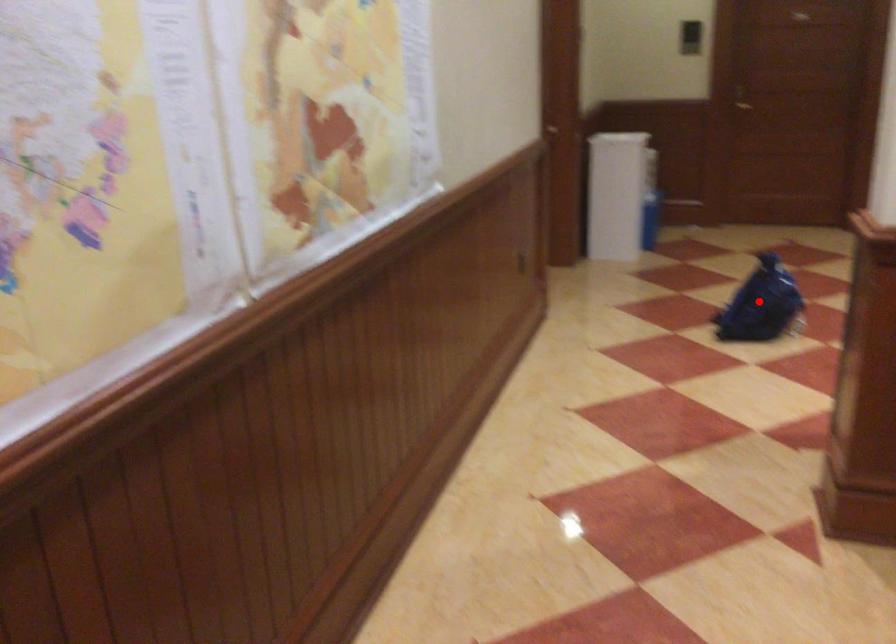
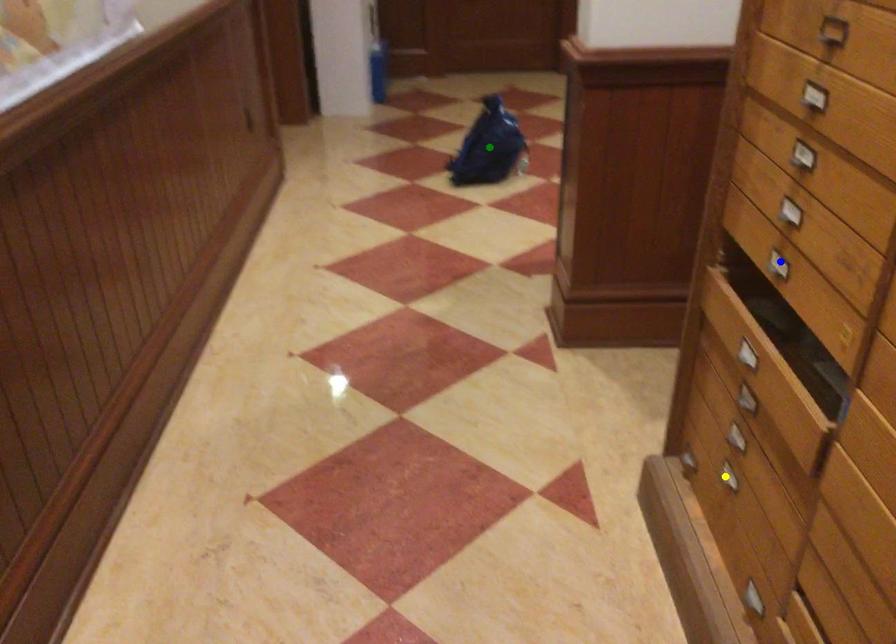
Question: I am providing you with two images of the same scene from different viewpoints. A red point is marked on the first image. You are given multiple points on the second image. Which point in image 2 is actually the same real-world point as the red point in image 1?

Choices:
 (A) blue point
 (B) yellow point
 (C) green point

Answer: (C)